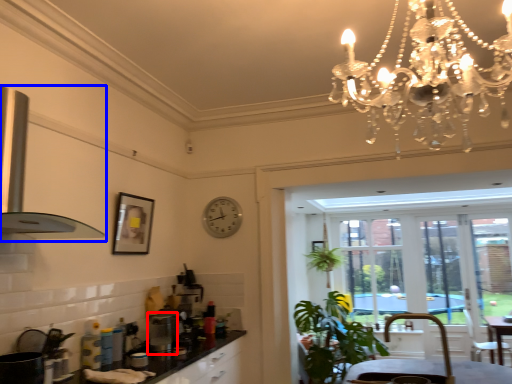
Question: Among these objects, which one is nearest to the camera, appliance (highlighted by a red box) or exhaust hood (highlighted by a blue box)?

Choices:
 (A) appliance
 (B) exhaust hood

Answer: (B)